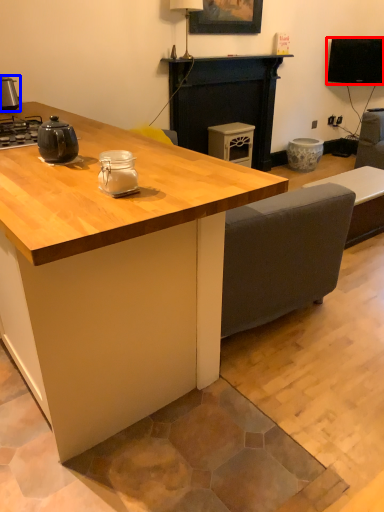
Question: Which of the following is the farthest to the observer, television (highlighted by a red box) or appliance (highlighted by a blue box)?

Choices:
 (A) television
 (B) appliance

Answer: (A)